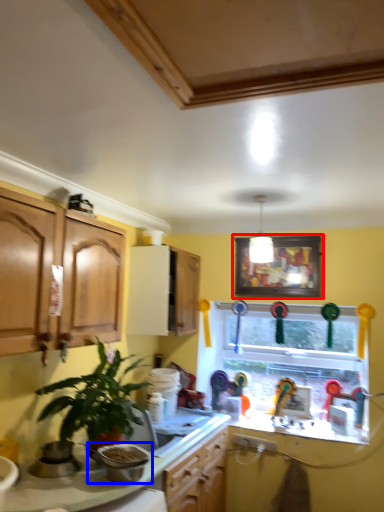
Question: Which point is further to the camera, picture frame (highlighted by a red box) or appliance (highlighted by a blue box)?

Choices:
 (A) picture frame
 (B) appliance

Answer: (A)